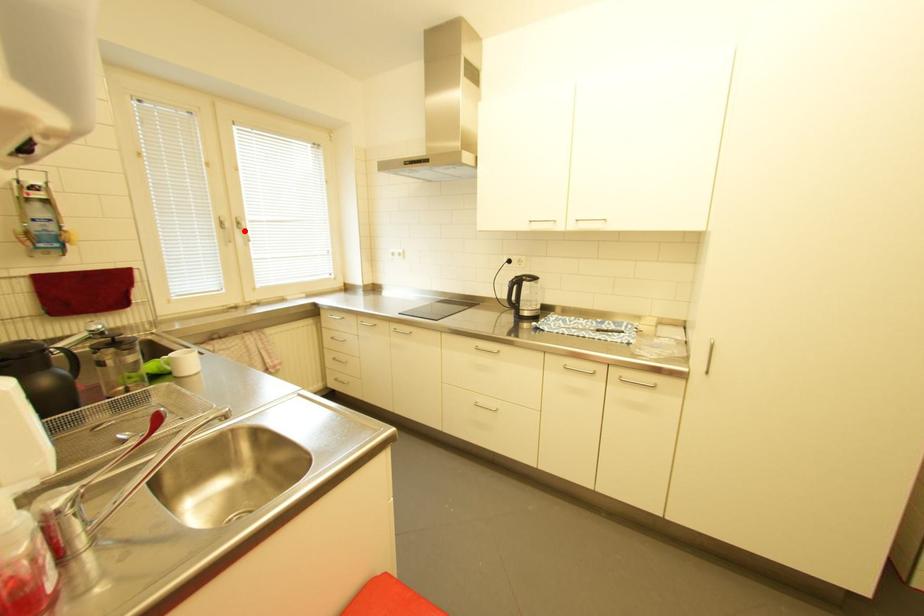
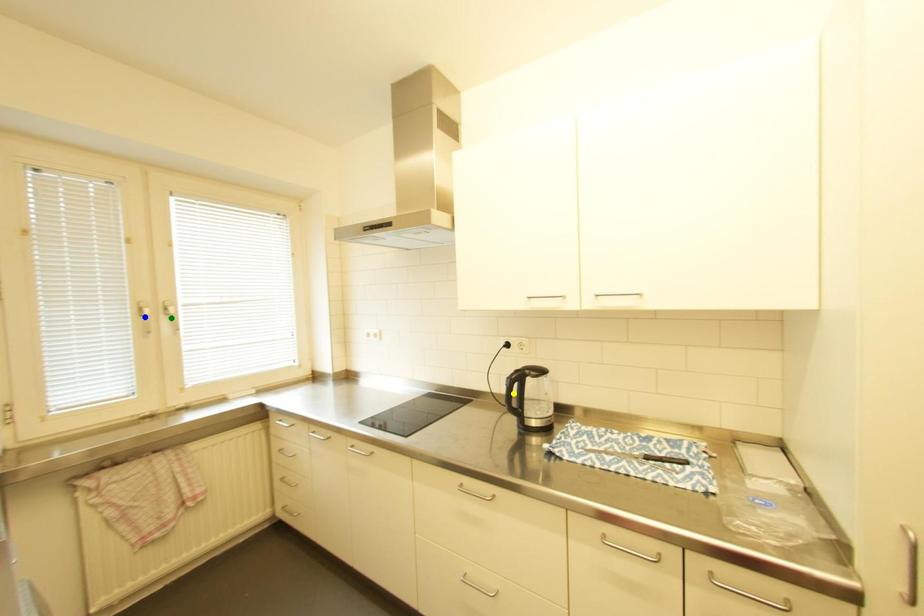
Question: I am providing you with two images of the same scene from different viewpoints. A red point is marked on the first image. You are given multiple points on the second image. Which spot in image 2 lines up with the point in image 1?

Choices:
 (A) blue point
 (B) green point
 (C) yellow point

Answer: (B)